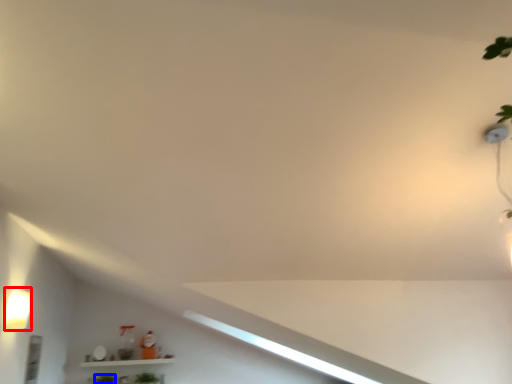
Question: Which object appears closest to the camera in this image, light fixture (highlighted by a red box) or plant (highlighted by a blue box)?

Choices:
 (A) light fixture
 (B) plant

Answer: (A)